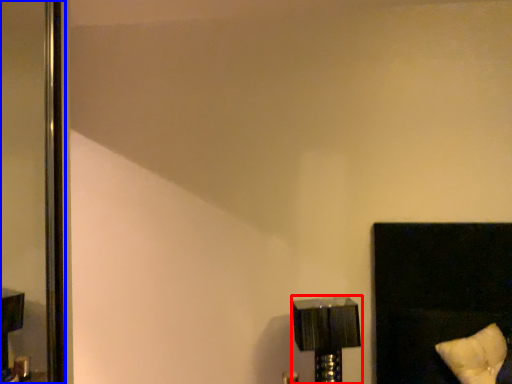
Question: Which of the following is the closest to the observer, lamp (highlighted by a red box) or screen door (highlighted by a blue box)?

Choices:
 (A) lamp
 (B) screen door

Answer: (A)